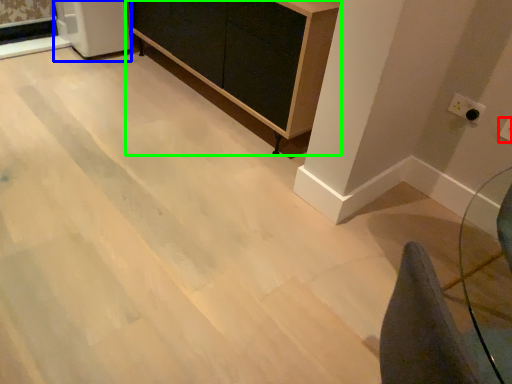
Question: Estimate the real-world distances between objects in this image. Which object is farther from electric outlet (highlighted by a red box), appliance (highlighted by a blue box) or furniture (highlighted by a green box)?

Choices:
 (A) appliance
 (B) furniture

Answer: (A)